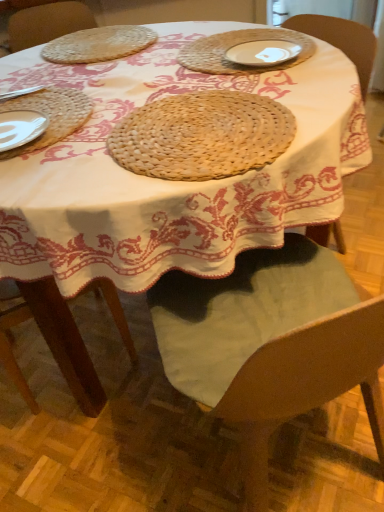
Locate an element on the screen. vacant space situated on the left part of wooden chair at center is located at coordinates (111, 429).